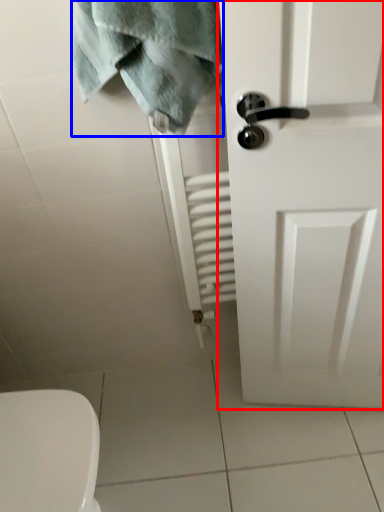
Question: Which object is further to the camera taking this photo, door (highlighted by a red box) or bath towel (highlighted by a blue box)?

Choices:
 (A) door
 (B) bath towel

Answer: (B)